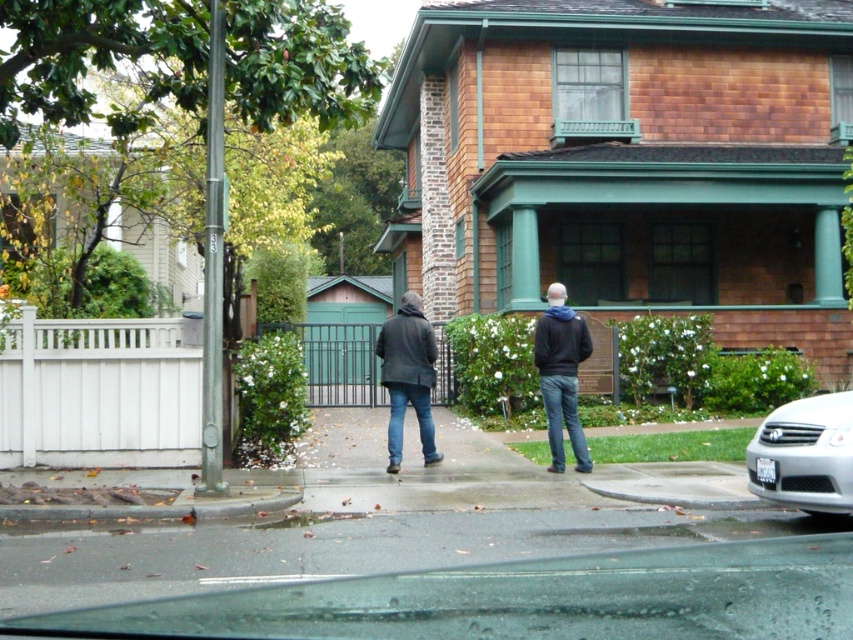
Is silver metallic sedan at lower right above black matte jacket at center?

No, silver metallic sedan at lower right is not above black matte jacket at center.

Between point (822, 467) and point (541, 376), which one is positioned in front?

Point (822, 467) is more forward.

The height and width of the screenshot is (640, 853). Find the location of `silver metallic sedan at lower right`. silver metallic sedan at lower right is located at coordinates (805, 454).

Consider the image. Does dark gray jacket at center appear over black matte jacket at center?

Yes.

Is dark gray jacket at center taller than black matte jacket at center?

Incorrect, dark gray jacket at center's height is not larger of black matte jacket at center's.

Between point (403, 378) and point (564, 372), which one is positioned behind?

The point (403, 378) is behind.

Identify the location of dark gray jacket at center. The height and width of the screenshot is (640, 853). (561, 381).

Between smooth asphalt pavement at lower center and dark gray jacket at center, which one is positioned lower?

smooth asphalt pavement at lower center

Looking at this image, can you confirm if smooth asphalt pavement at lower center is positioned to the right of dark gray jacket at center?

In fact, smooth asphalt pavement at lower center is to the left of dark gray jacket at center.

Who is more distant from viewer, [685,611] or [398,353]?

Point [398,353]

You are a GUI agent. You are given a task and a screenshot of the screen. Output one action in this format:
    pyautogui.click(x=<x>, y=<y>)
    Task: Click on the smooth asphalt pavement at lower center
    This screenshot has width=853, height=640.
    Given the screenshot: What is the action you would take?
    pyautogui.click(x=538, y=593)